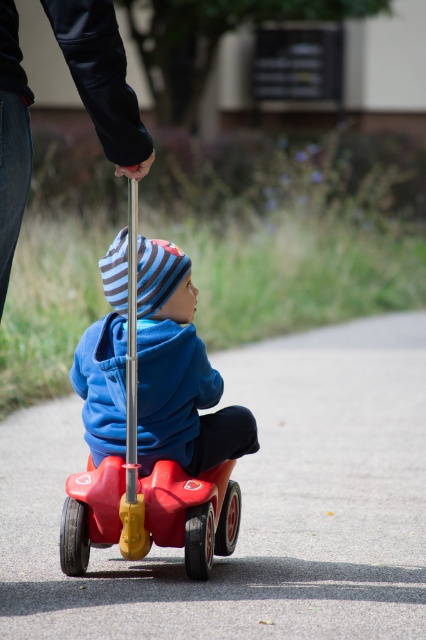
Is point (101, 134) in front of point (77, 506)?

Yes, it is.

Image resolution: width=426 pixels, height=640 pixels. Identify the location of black leather jacket at upper left. (100, 74).

The image size is (426, 640). Describe the element at coordinates (100, 74) in the screenshot. I see `black leather jacket at upper left` at that location.

In order to click on black leather jacket at upper left in this screenshot , I will do `click(100, 74)`.

Which of these two, matte blue hoodie at center or black leather jacket at upper left, stands shorter?

matte blue hoodie at center is shorter.

Between point (167, 244) and point (92, 116), which one is positioned in front?

Point (92, 116) is more forward.

Locate an element on the screen. The height and width of the screenshot is (640, 426). matte blue hoodie at center is located at coordinates (178, 378).

Who is higher up, matte blue hoodie at center or rubberized plastic toy car at center?

matte blue hoodie at center is higher up.

Who is positioned more to the right, matte blue hoodie at center or rubberized plastic toy car at center?

Positioned to the right is rubberized plastic toy car at center.

Identify the location of matte blue hoodie at center. click(178, 378).

The image size is (426, 640). I want to click on matte blue hoodie at center, so click(178, 378).